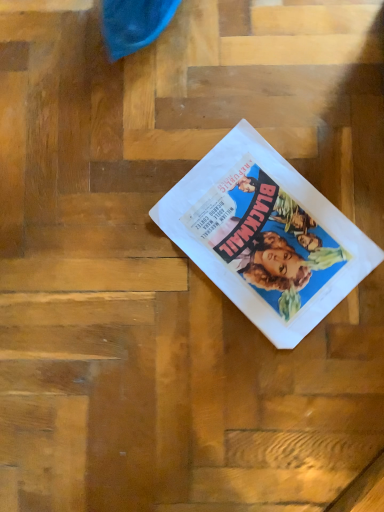
Question: Should I look upward or downward to see white paper at center?

Choices:
 (A) up
 (B) down

Answer: (A)